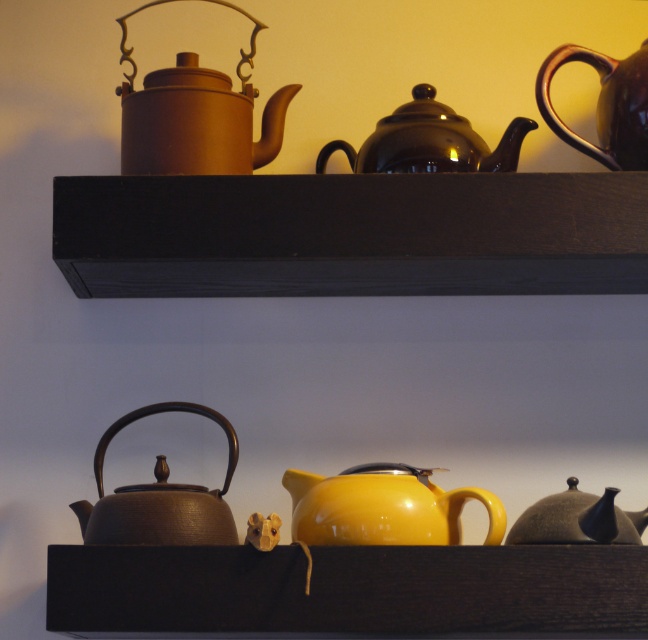
From the picture: Which is more to the right, matte brown teapot at upper left or yellow glossy teapot at center?

yellow glossy teapot at center

Which is behind, point (143, 93) or point (424, 538)?

The point (143, 93) is behind.

Locate an element on the screen. matte brown teapot at upper left is located at coordinates tap(196, 115).

Does matte brown teapot at upper left appear under shiny dark brown teapot at upper right?

Correct, matte brown teapot at upper left is located below shiny dark brown teapot at upper right.

Between matte brown teapot at upper left and shiny dark brown teapot at upper right, which one is positioned higher?

shiny dark brown teapot at upper right is above.

Between point (222, 152) and point (551, 65), which one is positioned in front?

Point (222, 152)

Find the location of `matte brown teapot at upper left`. matte brown teapot at upper left is located at coordinates (196, 115).

Between black wood shelf at upper center and glossy ceramic teapot at upper center, which one has less height?

With less height is glossy ceramic teapot at upper center.

Is point (559, 204) closer to viewer compared to point (380, 156)?

Yes, point (559, 204) is in front of point (380, 156).

Identify the location of black wood shelf at upper center. The image size is (648, 640). tap(351, 234).